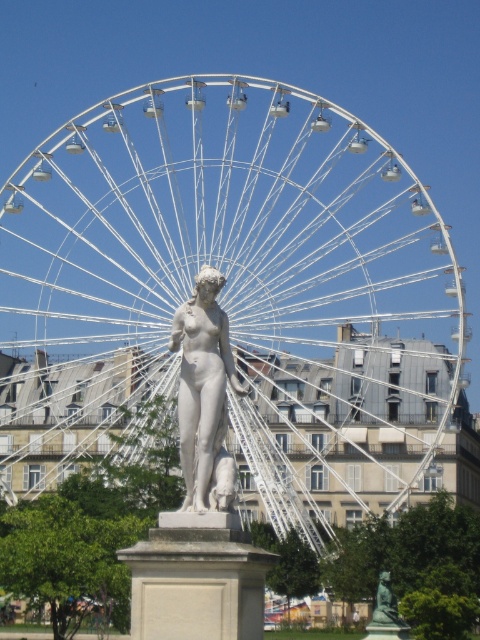
Based on the photo, you are standing at the point closest to the statue and want to walk towards the Ferris wheel. Which point should you walk towards first, point (x=405, y=412) or point (x=188, y=384)?

You should walk towards point (x=188, y=384) first because point (x=405, y=412) is behind point (x=188, y=384), so the closer point to the Ferris wheel is point (x=188, y=384).